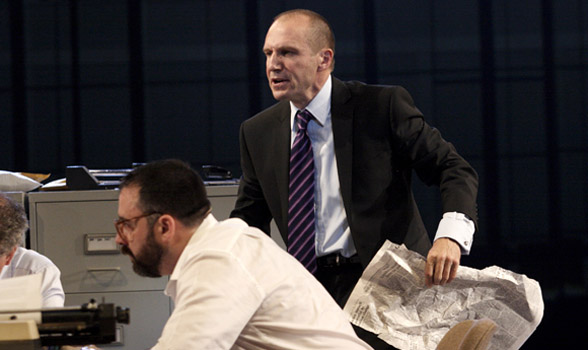
The height and width of the screenshot is (350, 588). In order to click on back of chair in this screenshot , I will do `click(467, 331)`.